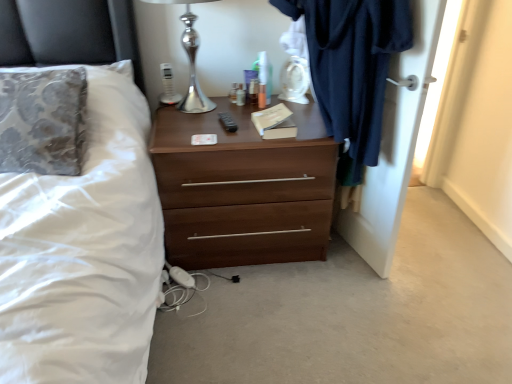
Where is `vacant point to the right of dark blue fabric at right`? This screenshot has width=512, height=384. vacant point to the right of dark blue fabric at right is located at coordinates (434, 248).